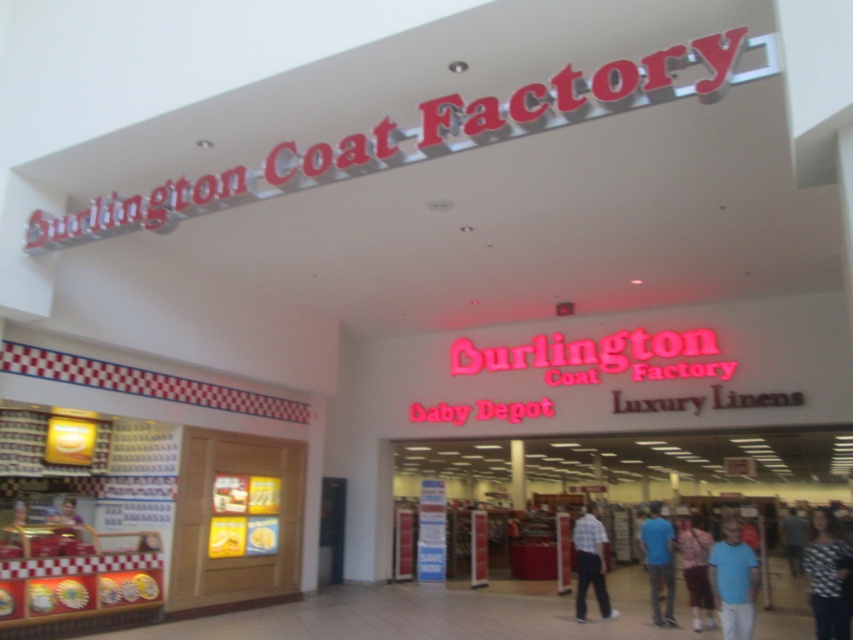
You are a customer in the Burlington Coat Factory store and want to place a coat hanger between the patterned fabric shirt at lower right and the blue shirt at center. The hanger is 1 foot wide. Is there enough space to fit it between them?

The patterned fabric shirt at lower right and blue shirt at center are 12.03 feet apart, so yes, there is enough space to place the 1 foot wide hanger between them since the distance is significantly larger than the hanger.

You are standing at the entrance of the Burlington Coat Factory store and see a blue cotton shirt at lower right and a plaid shirt at center. Which shirt is closer to you?

The blue cotton shirt at lower right is closer to the viewer than the plaid shirt at center.